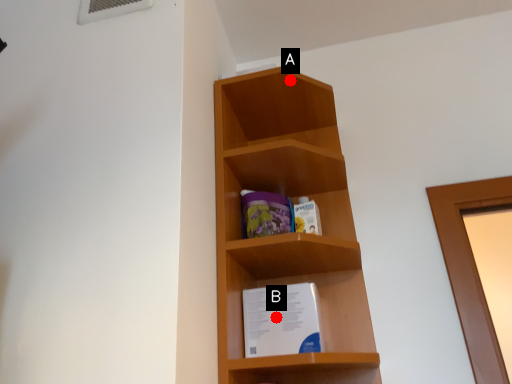
Question: Two points are circled on the image, labeled by A and B beside each circle. Which point is closer to the camera?

Choices:
 (A) A is closer
 (B) B is closer

Answer: (B)